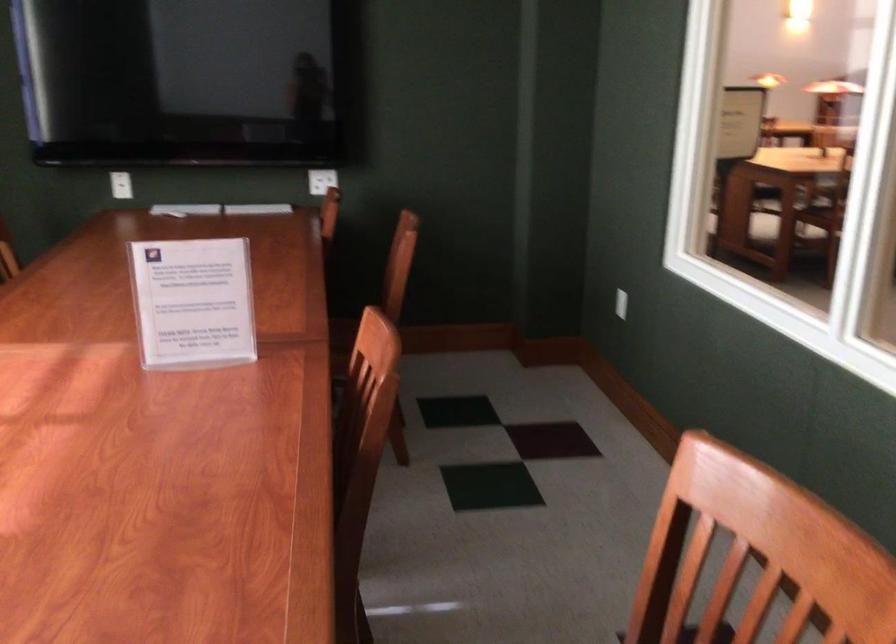
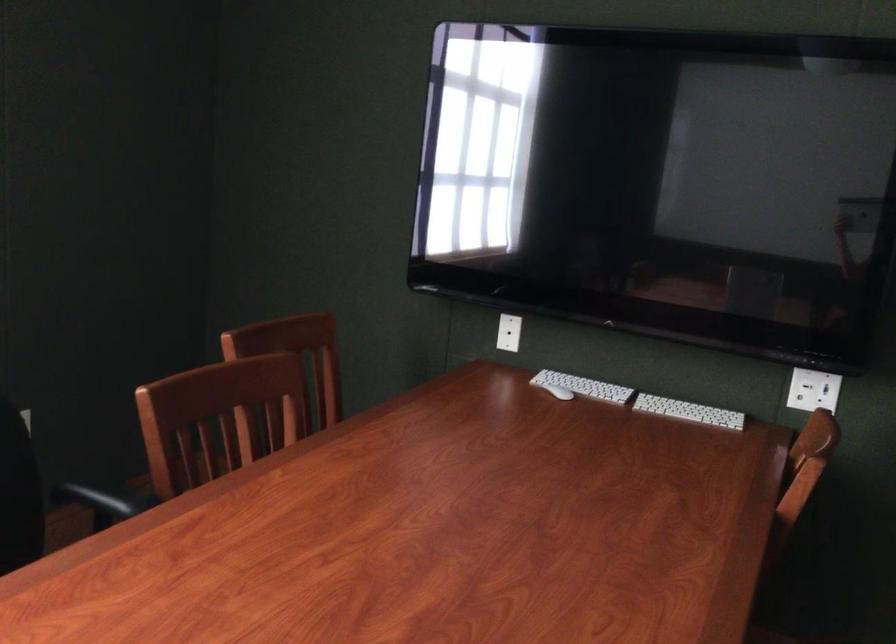
Locate, in the second image, the point that corresponds to point 328,178 in the first image.

(813, 390)